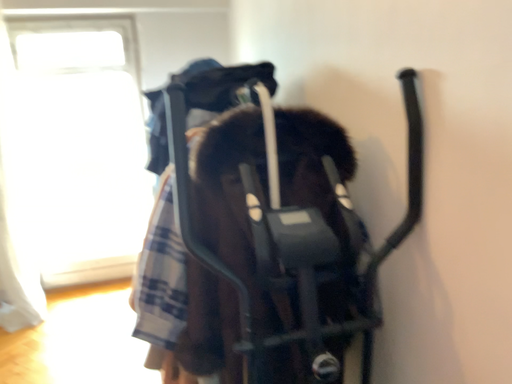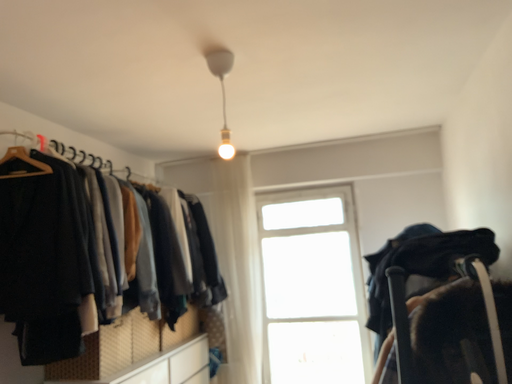
Question: How did the camera likely rotate when shooting the video?

Choices:
 (A) rotated right
 (B) rotated left

Answer: (B)